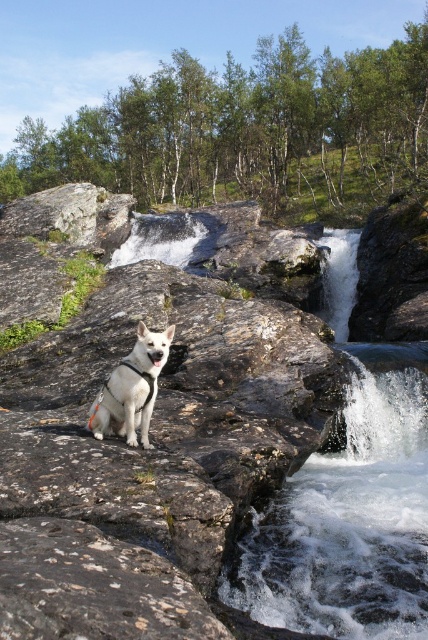
You are a hiker who wants to cross the stream in the image. You see the white stone creek at center and the white frothy water at lower right. Which part of the stream should you avoid stepping into to stay safe?

You should avoid stepping into the white frothy water at lower right because it indicates faster moving water, making it more dangerous than the white stone creek at center which is calmer.

You are a photographer wanting to capture a photo of the white matte dog at center and the white stone creek at center. Since both are white, you need to adjust your camera settings to ensure proper exposure. Which object should you expose for first to ensure the other remains visible in the final image?

The white stone creek at center is wider than the white matte dog at center. Therefore, you should expose for the wider white stone creek at center first to ensure the narrower white matte dog at center remains visible.

You are a hiker who wants to cross the white stone creek at center. You see a rock at point (157, 401). Is the rock part of the creek?

The white stone creek at center is located at point (157, 401), so the rock is part of the creek.